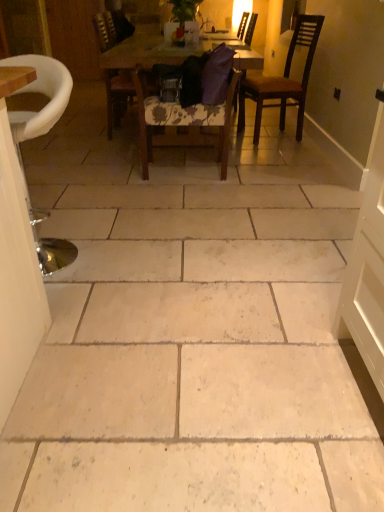
Where is `free space in front of dark brown wooden chair at upper right, the third chair when ordered from front to back`? The image size is (384, 512). free space in front of dark brown wooden chair at upper right, the third chair when ordered from front to back is located at coordinates (287, 151).